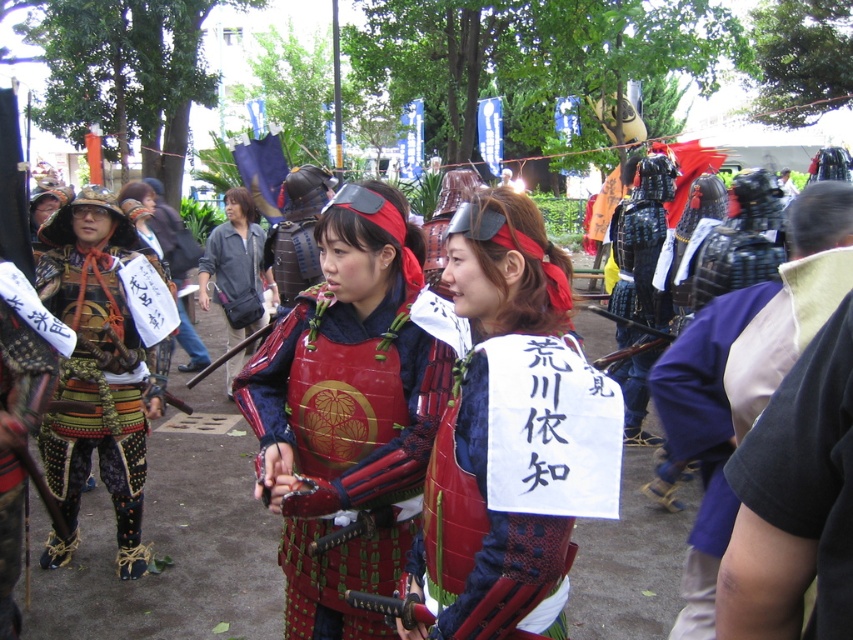
You are a photographer at the festival and want to capture both the matte red samurai armor at center and the dark purple fabric at center in the same frame. Which object should you focus on first to ensure both are in the shot?

The matte red samurai armor at center is positioned on the left side of dark purple fabric at center. To capture both in the same frame, focus on the matte red samurai armor at center first as it is closer to the left edge, allowing the dark purple fabric at center to be included on the right side of the frame.